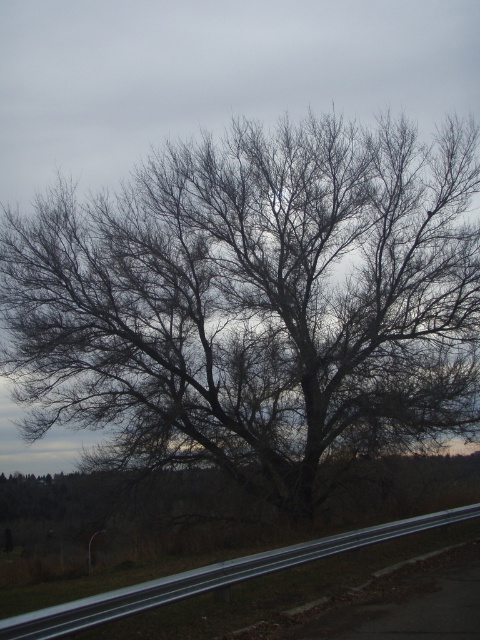
Does bare branches at center have a greater height compared to metallic gray highway at lower center?

Yes.

Is bare branches at center bigger than metallic gray highway at lower center?

Correct, bare branches at center is larger in size than metallic gray highway at lower center.

Find the location of a particular element. This screenshot has height=640, width=480. bare branches at center is located at coordinates (254, 304).